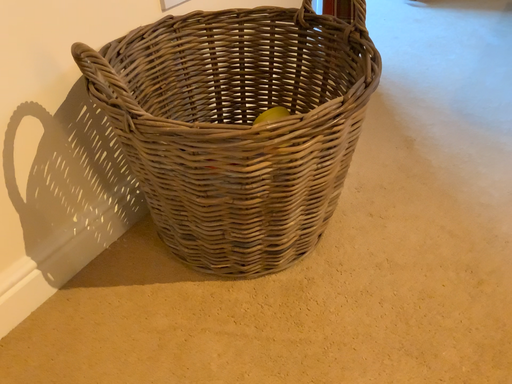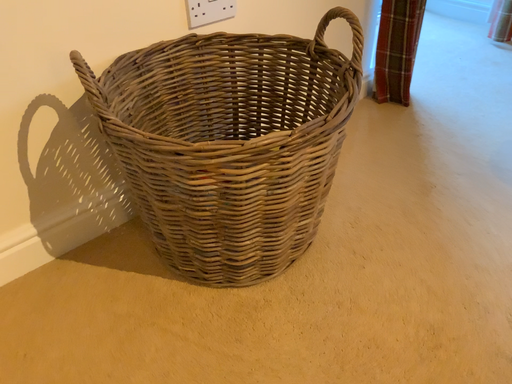
Question: How did the camera likely rotate when shooting the video?

Choices:
 (A) rotated right
 (B) rotated left

Answer: (B)